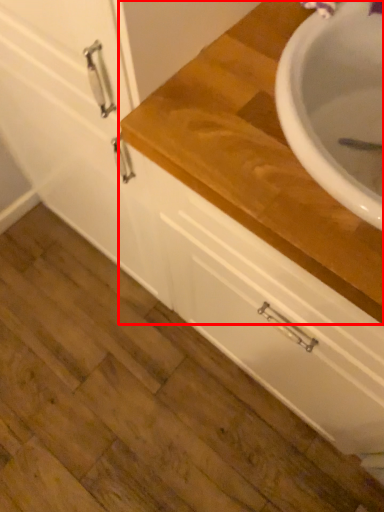
Question: In this image, where is countertop (annotated by the red box) located relative to drawer?

Choices:
 (A) right
 (B) left

Answer: (A)